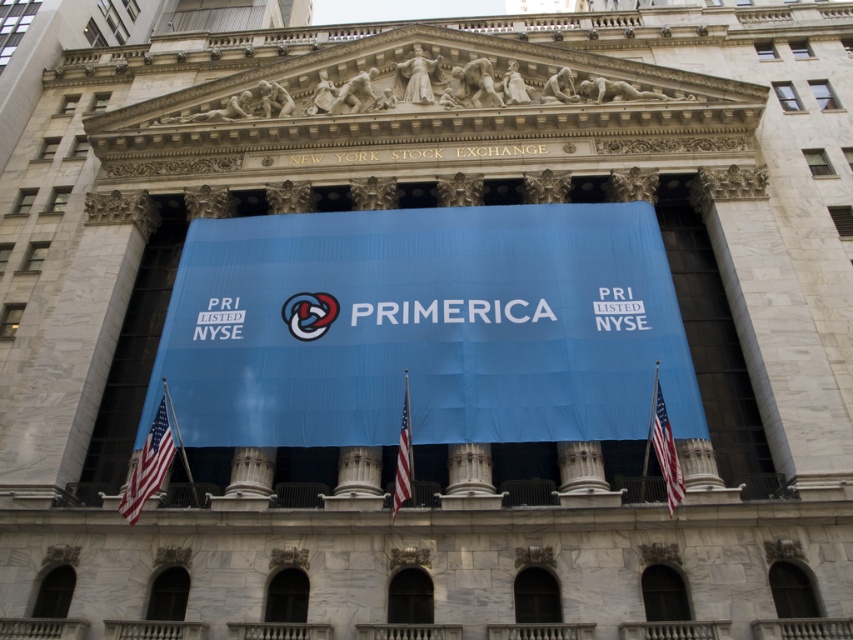
Question: Is white fabric flag at lower left closer to the viewer compared to red fabric flag at right?

Choices:
 (A) yes
 (B) no

Answer: (B)

Question: Can you confirm if blue fabric banner at center is bigger than white fabric flag at center?

Choices:
 (A) no
 (B) yes

Answer: (B)

Question: Considering the real-world distances, which object is closest to the white fabric flag at center?

Choices:
 (A) red fabric flag at right
 (B) white fabric flag at lower left
 (C) blue fabric banner at center

Answer: (C)

Question: Which object is closer to the camera taking this photo?

Choices:
 (A) white fabric flag at lower left
 (B) red fabric flag at right
 (C) white fabric flag at center

Answer: (B)

Question: Which point is farther from the camera taking this photo?

Choices:
 (A) (398, 492)
 (B) (154, 481)
 (C) (660, 467)

Answer: (B)

Question: Is white fabric flag at lower left below red fabric flag at right?

Choices:
 (A) yes
 (B) no

Answer: (A)